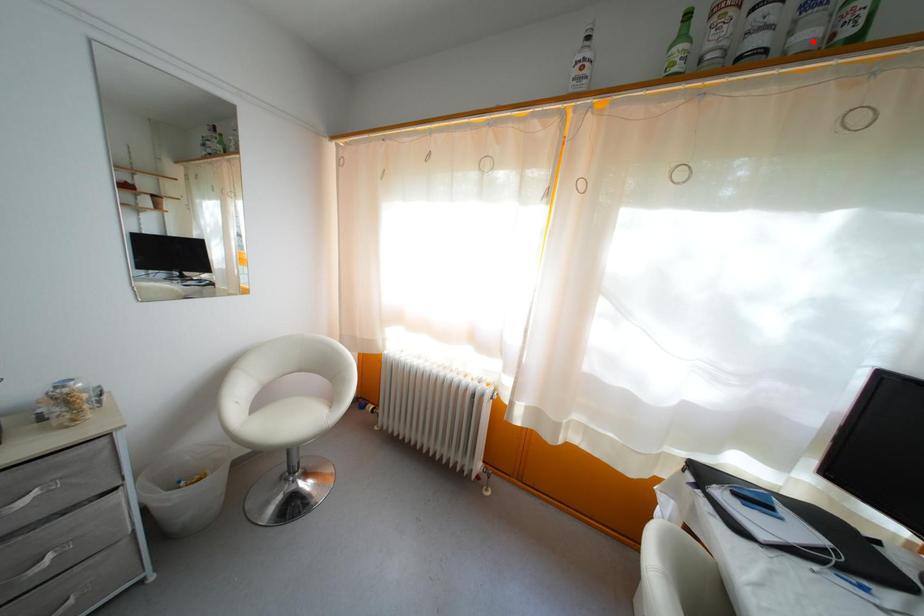
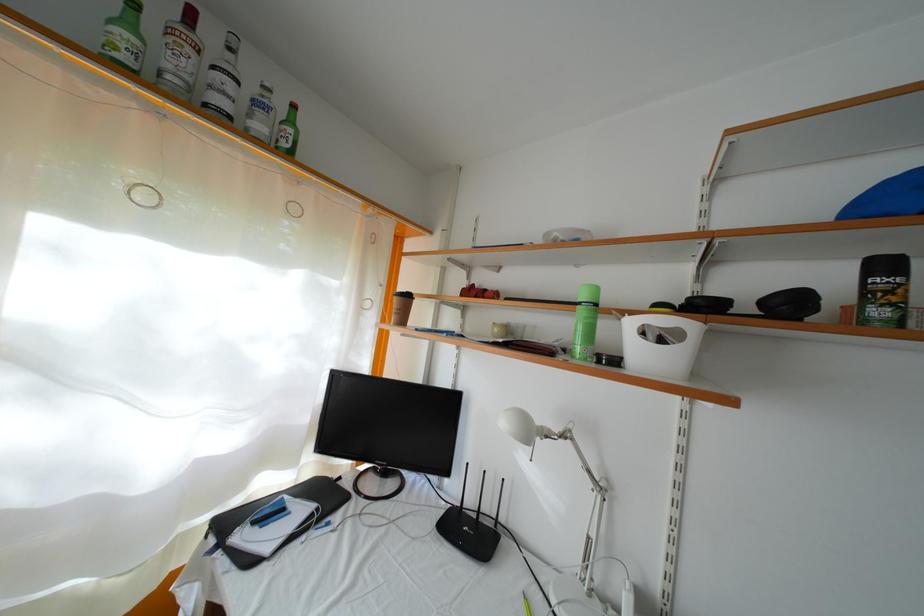
The point at the highlighted location is marked in the first image. Where is the corresponding point in the second image?

(264, 134)